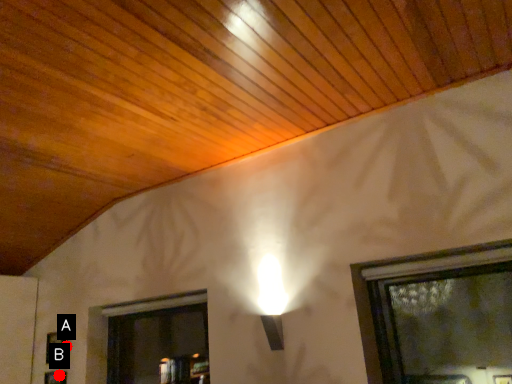
Question: Two points are circled on the image, labeled by A and B beside each circle. Which of the following is the closest to the observer?

Choices:
 (A) A is closer
 (B) B is closer

Answer: (B)